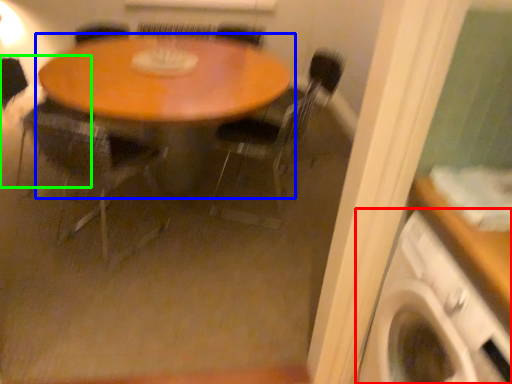
Question: Estimate the real-world distances between objects in this image. Which object is closer to washing machine (highlighted by a red box), table (highlighted by a blue box) or armchair (highlighted by a green box)?

Choices:
 (A) table
 (B) armchair

Answer: (A)